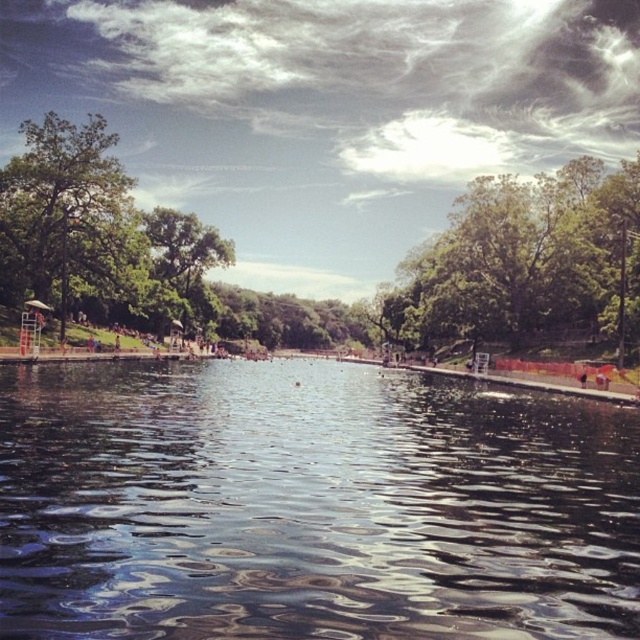
Question: Observing the image, what is the correct spatial positioning of transparent water at center in reference to green leafy tree at left?

Choices:
 (A) below
 (B) above

Answer: (A)

Question: Can you confirm if green leafy tree at upper center is smaller than green leafy tree at left?

Choices:
 (A) yes
 (B) no

Answer: (A)

Question: Which point appears farthest from the camera in this image?

Choices:
 (A) (634, 298)
 (B) (550, 632)

Answer: (A)

Question: Which point is closer to the camera?

Choices:
 (A) (499, 333)
 (B) (33, 138)

Answer: (B)

Question: Among these objects, which one is farthest from the camera?

Choices:
 (A) green leafy tree at left
 (B) green leafy tree at upper center
 (C) transparent water at center

Answer: (A)

Question: Can you confirm if transparent water at center is positioned above green leafy tree at left?

Choices:
 (A) yes
 (B) no

Answer: (B)